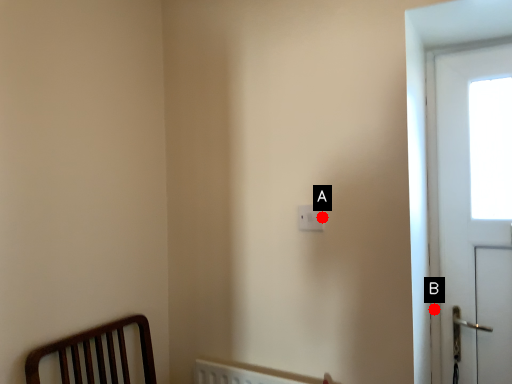
Question: Two points are circled on the image, labeled by A and B beside each circle. Which of the following is the closest to the observer?

Choices:
 (A) A is closer
 (B) B is closer

Answer: (A)